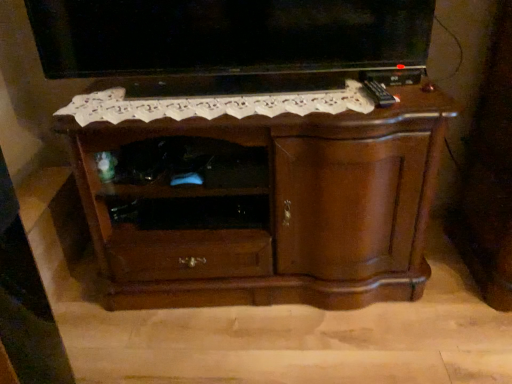
Question: From a real-world perspective, relative to shiny brown cabinet at center, is matte black tv at upper center vertically above or below?

Choices:
 (A) above
 (B) below

Answer: (A)

Question: Considering the positions of point (184, 8) and point (108, 223), is point (184, 8) closer or farther from the camera than point (108, 223)?

Choices:
 (A) farther
 (B) closer

Answer: (B)

Question: Considering the positions of matte black tv at upper center and shiny brown cabinet at center in the image, is matte black tv at upper center wider or thinner than shiny brown cabinet at center?

Choices:
 (A) wide
 (B) thin

Answer: (B)

Question: From a real-world perspective, is shiny brown cabinet at center positioned above or below matte black tv at upper center?

Choices:
 (A) above
 (B) below

Answer: (B)

Question: In the image, is shiny brown cabinet at center on the left side or the right side of matte black tv at upper center?

Choices:
 (A) left
 (B) right

Answer: (B)

Question: Is shiny brown cabinet at center in front of or behind matte black tv at upper center in the image?

Choices:
 (A) behind
 (B) front

Answer: (B)

Question: Is shiny brown cabinet at center wider or thinner than matte black tv at upper center?

Choices:
 (A) wide
 (B) thin

Answer: (A)